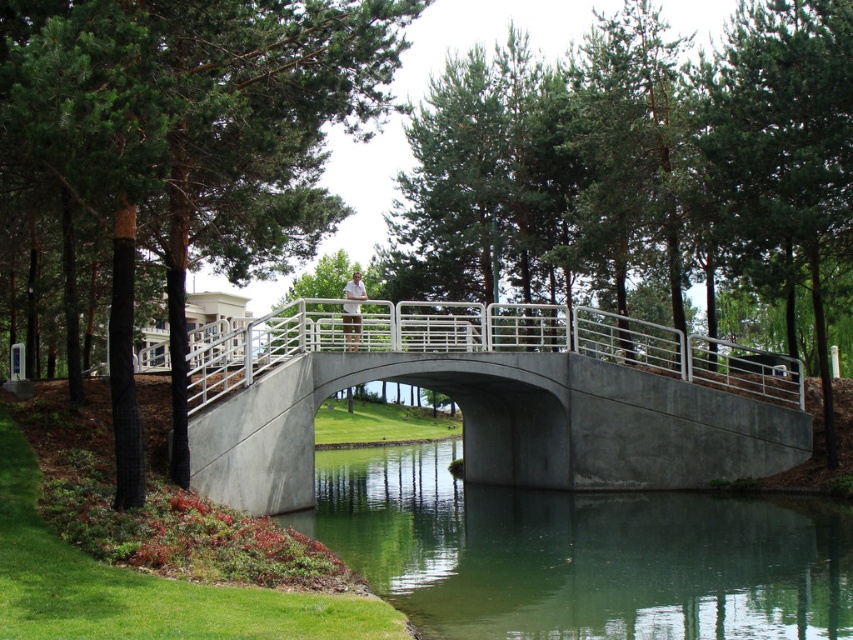
Question: Estimate the real-world distances between objects in this image. Which object is farther from the green leafy tree at upper center?

Choices:
 (A) green smooth water at center
 (B) concrete bridge at center

Answer: (A)

Question: Which of the following is the closest to the observer?

Choices:
 (A) green smooth water at center
 (B) concrete bridge at center

Answer: (A)

Question: Among these points, which one is nearest to the camera?

Choices:
 (A) (459, 342)
 (B) (82, 115)

Answer: (B)

Question: Is green leafy tree at upper center to the right of concrete bridge at center from the viewer's perspective?

Choices:
 (A) no
 (B) yes

Answer: (A)

Question: Considering the relative positions of green leafy tree at upper center and green smooth water at center in the image provided, where is green leafy tree at upper center located with respect to green smooth water at center?

Choices:
 (A) below
 (B) above

Answer: (B)

Question: Can you confirm if concrete bridge at center is positioned to the left of green smooth water at center?

Choices:
 (A) no
 (B) yes

Answer: (B)